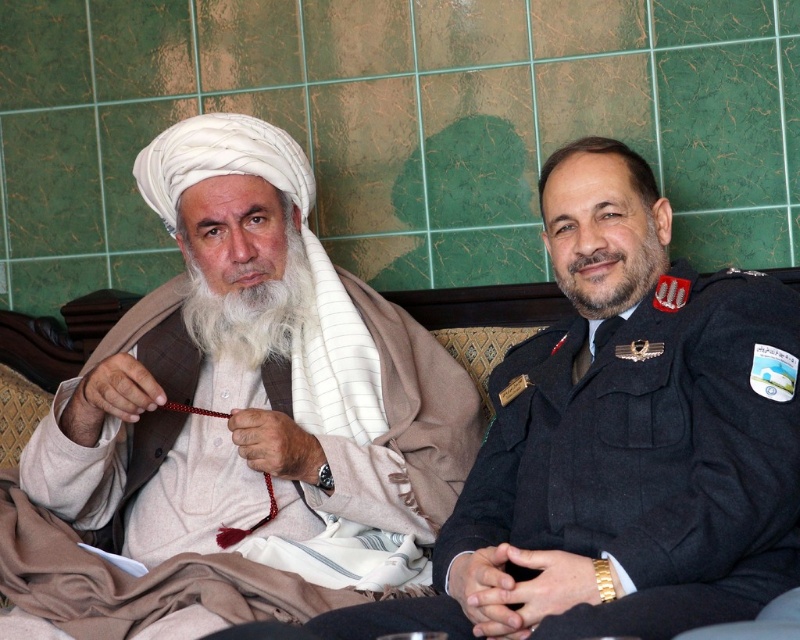
Is the position of white woolen turban at left more distant than that of white soft beard at left?

No, white woolen turban at left is closer to the viewer.

Is white woolen turban at left smaller than white soft beard at left?

Actually, white woolen turban at left might be larger than white soft beard at left.

I want to click on white woolen turban at left, so click(236, 422).

At what (x,y) coordinates should I click in order to perform the action: click on white woolen turban at left. Please return your answer as a coordinate pair (x, y). Image resolution: width=800 pixels, height=640 pixels. Looking at the image, I should click on (236, 422).

Measure the distance between white woolen turban at left and camera.

They are 4.31 feet apart.

Is white woolen turban at left to the left of dark brown thick beard at right from the viewer's perspective?

Indeed, white woolen turban at left is positioned on the left side of dark brown thick beard at right.

Find the location of a particular element. Image resolution: width=800 pixels, height=640 pixels. white woolen turban at left is located at coordinates (236, 422).

The height and width of the screenshot is (640, 800). Describe the element at coordinates (621, 440) in the screenshot. I see `dark blue uniform at right` at that location.

This screenshot has height=640, width=800. Identify the location of dark blue uniform at right. (621, 440).

What do you see at coordinates (621, 440) in the screenshot? This screenshot has width=800, height=640. I see `dark blue uniform at right` at bounding box center [621, 440].

Locate an element on the screen. The width and height of the screenshot is (800, 640). dark blue uniform at right is located at coordinates (621, 440).